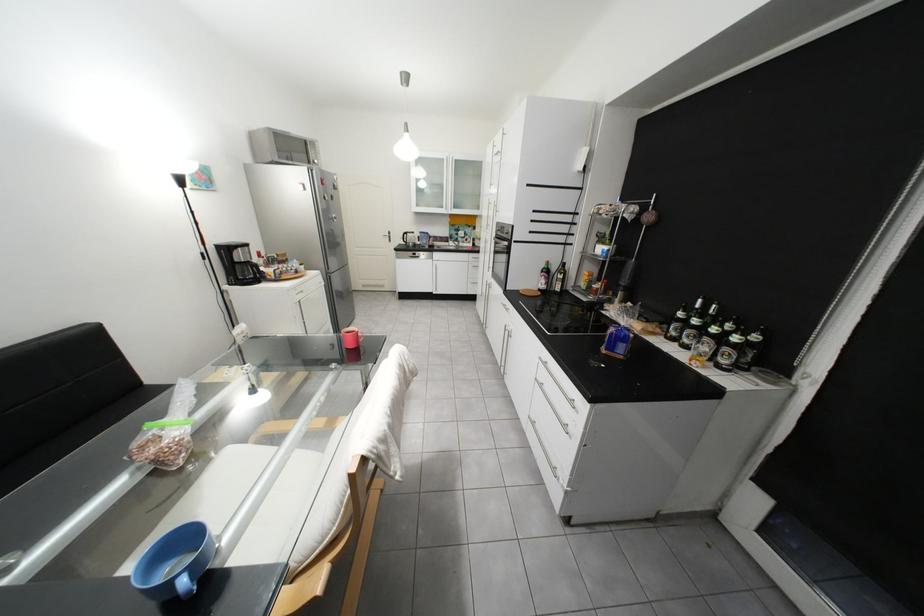
I want to click on coffee carafe handle, so click(x=256, y=272).